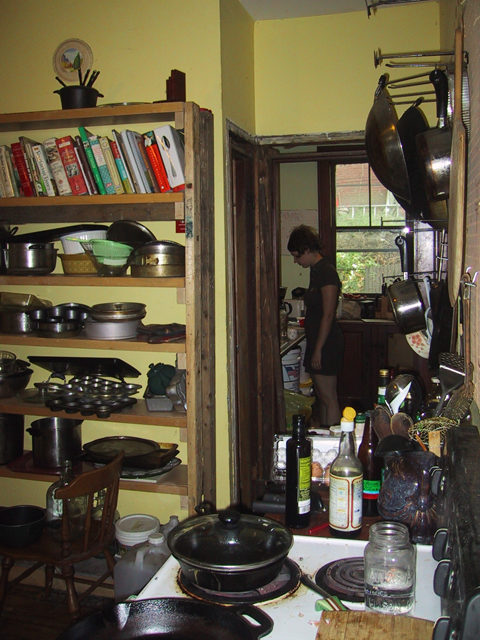
Where is `wall`? The height and width of the screenshot is (640, 480). wall is located at coordinates (279, 93).